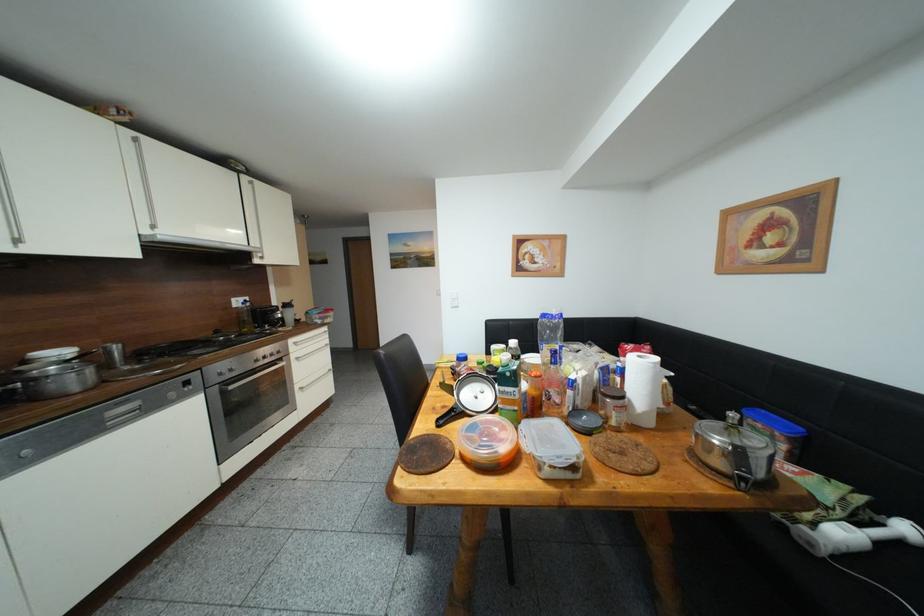
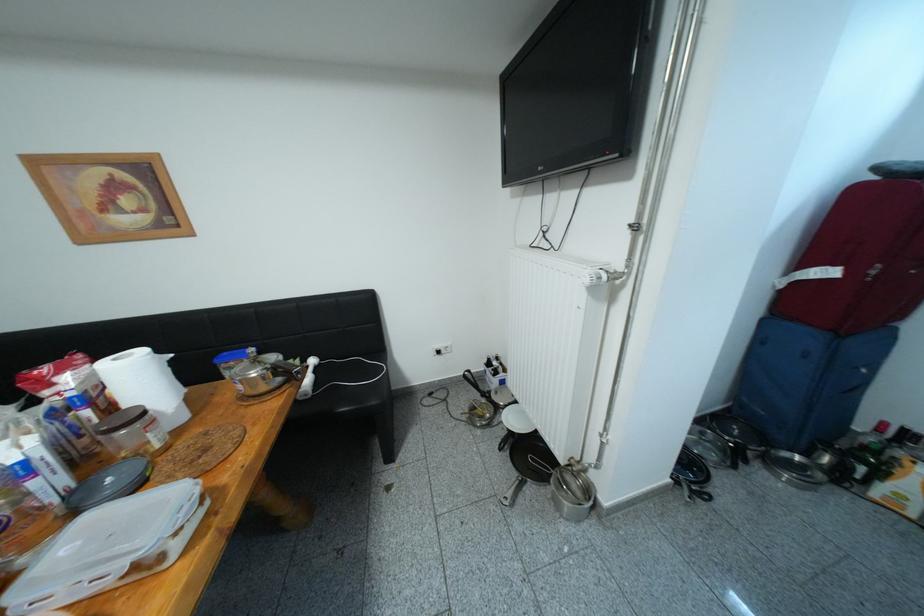
Based on the continuous images, in which direction is the camera rotating?

The camera's rotation is toward right-down.